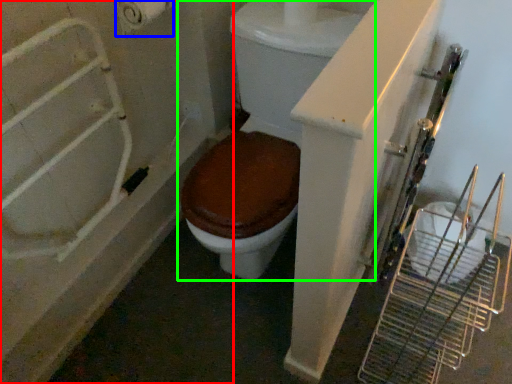
Question: Based on their relative distances, which object is farther from bath (highlighted by a red box)? Choose from toilet paper (highlighted by a blue box) and toilet (highlighted by a green box).

Choices:
 (A) toilet paper
 (B) toilet

Answer: (A)